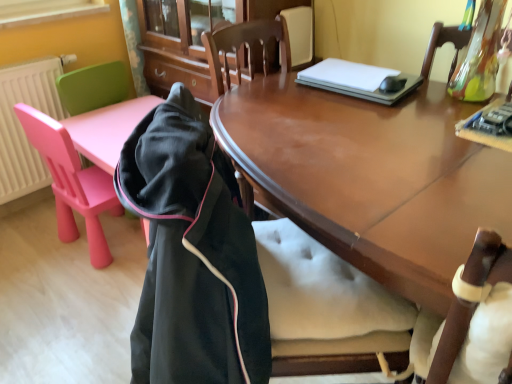
This screenshot has height=384, width=512. Describe the element at coordinates (192, 255) in the screenshot. I see `black fleece jacket at left` at that location.

Describe the element at coordinates (72, 183) in the screenshot. I see `pink plastic chair at left, the 2th chair when ordered from back to front` at that location.

What do you see at coordinates (101, 111) in the screenshot? The width and height of the screenshot is (512, 384). I see `pink plastic chair at left, which ranks as the first chair in back-to-front order` at bounding box center [101, 111].

I want to click on shiny brown wood desk at center, so click(371, 177).

Is pink plastic chair at left, which ranks as the first chair in back-to-front order, smaller than black fleece jacket at left?

Yes.

Looking at this image, in terms of width, does pink plastic chair at left, which ranks as the first chair in back-to-front order, look wider or thinner when compared to black fleece jacket at left?

In the image, pink plastic chair at left, which ranks as the first chair in back-to-front order, appears to be wider than black fleece jacket at left.

There is a black fleece jacket at left. Where is `the 2nd chair above it (from the image's perspective)`? This screenshot has height=384, width=512. the 2nd chair above it (from the image's perspective) is located at coordinates (101, 111).

From a real-world perspective, which object stands above the other?

black fleece jacket at left, from a real-world perspective.

Considering the relative sizes of pink plastic chair at left, the 2th chair when ordered from back to front, and matte wood cabinet at center in the image provided, is pink plastic chair at left, the 2th chair when ordered from back to front, shorter than matte wood cabinet at center?

Indeed, pink plastic chair at left, the 2th chair when ordered from back to front, has a lesser height compared to matte wood cabinet at center.

Which is less distant, [24,116] or [172,54]?

Point [24,116].

From the image's perspective, which object appears higher, pink plastic chair at left, the 2th chair when ordered from back to front, or matte wood cabinet at center?

matte wood cabinet at center is shown above in the image.

How much distance is there between pink plastic chair at left, the 2th chair when ordered from back to front, and matte wood cabinet at center?

A distance of 71.38 centimeters exists between pink plastic chair at left, the 2th chair when ordered from back to front, and matte wood cabinet at center.

Is pink plastic chair at left, placed as the 1th chair when sorted from front to back, further to camera compared to shiny brown wood desk at center?

Yes, it is.

From the image's perspective, relative to shiny brown wood desk at center, is pink plastic chair at left, placed as the 1th chair when sorted from front to back, above or below?

From the image's perspective, pink plastic chair at left, placed as the 1th chair when sorted from front to back, appears above shiny brown wood desk at center.

Does pink plastic chair at left, the 2th chair when ordered from back to front, touch shiny brown wood desk at center?

There is a gap between pink plastic chair at left, the 2th chair when ordered from back to front, and shiny brown wood desk at center.

Is pink plastic chair at left, the 2th chair when ordered from back to front, spatially inside shiny brown wood desk at center, or outside of it?

pink plastic chair at left, the 2th chair when ordered from back to front, is not inside shiny brown wood desk at center, it's outside.

From a real-world perspective, relative to black fleece jacket at left, is shiny brown wood desk at center vertically above or below?

In terms of real-world spatial position, shiny brown wood desk at center is below black fleece jacket at left.

Considering the sizes of shiny brown wood desk at center and black fleece jacket at left in the image, is shiny brown wood desk at center wider or thinner than black fleece jacket at left?

Clearly, shiny brown wood desk at center has more width compared to black fleece jacket at left.

Locate an element on the screen. The height and width of the screenshot is (384, 512). desk behind the black fleece jacket at left is located at coordinates (371, 177).

Considering the sizes of objects black fleece jacket at left and white plastic radiator at left in the image provided, who is shorter, black fleece jacket at left or white plastic radiator at left?

Standing shorter between the two is white plastic radiator at left.

Locate an element on the screen. This screenshot has height=384, width=512. radiator above the black fleece jacket at left (from the image's perspective) is located at coordinates (21, 125).

From the image's perspective, would you say black fleece jacket at left is shown under white plastic radiator at left?

Indeed, from the image's perspective, black fleece jacket at left is shown beneath white plastic radiator at left.

Based on the photo, is black fleece jacket at left far from white plastic radiator at left?

Yes.

Does matte wood cabinet at center have a lesser height compared to white plastic radiator at left?

No.

Is matte wood cabinet at center next to white plastic radiator at left?

No, matte wood cabinet at center is not touching white plastic radiator at left.

At what (x,y) coordinates should I click in order to perform the action: click on cabinetry above the white plastic radiator at left (from a real-world perspective). Please return your answer as a coordinate pair (x, y). This screenshot has height=384, width=512. Looking at the image, I should click on (175, 46).

Does matte wood cabinet at center have a larger size compared to white plastic radiator at left?

Yes, matte wood cabinet at center is bigger than white plastic radiator at left.

Considering the sizes of objects black fleece jacket at left and pink plastic chair at left, the 2th chair when ordered from back to front, in the image provided, who is smaller, black fleece jacket at left or pink plastic chair at left, the 2th chair when ordered from back to front,?

A: With smaller size is pink plastic chair at left, the 2th chair when ordered from back to front.

From a real-world perspective, which is physically below, black fleece jacket at left or pink plastic chair at left, the 2th chair when ordered from back to front?

From a 3D spatial view, pink plastic chair at left, the 2th chair when ordered from back to front, is below.

Is black fleece jacket at left not near pink plastic chair at left, the 2th chair when ordered from back to front?

They are positioned close to each other.

Could you tell me if black fleece jacket at left is facing pink plastic chair at left, the 2th chair when ordered from back to front?

No, black fleece jacket at left does not turn towards pink plastic chair at left, the 2th chair when ordered from back to front.

Locate an element on the screen. The height and width of the screenshot is (384, 512). cloak above the pink plastic chair at left, the second chair positioned from the front (from a real-world perspective) is located at coordinates (192, 255).

This screenshot has width=512, height=384. What are the coordinates of `cabinetry lying behind the pink plastic chair at left, placed as the 1th chair when sorted from front to back` in the screenshot? It's located at (175, 46).

Estimate the real-world distances between objects in this image. Which object is further from shiny brown wood desk at center, pink plastic chair at left, placed as the 1th chair when sorted from front to back, or black fleece jacket at left?

pink plastic chair at left, placed as the 1th chair when sorted from front to back, lies further to shiny brown wood desk at center than the other object.

When comparing their distances from white plastic radiator at left, does matte wood cabinet at center or shiny brown wood desk at center seem closer?

Among the two, matte wood cabinet at center is located nearer to white plastic radiator at left.

Based on their spatial positions, is white plastic radiator at left or pink plastic chair at left, placed as the 1th chair when sorted from front to back, further from shiny brown wood desk at center?

The object further to shiny brown wood desk at center is white plastic radiator at left.

Consider the image. Considering their positions, is pink plastic chair at left, the second chair positioned from the front, positioned further to white plastic radiator at left than shiny brown wood desk at center?

shiny brown wood desk at center.

Looking at the image, which one is located closer to black fleece jacket at left, matte wood cabinet at center or white plastic radiator at left?

matte wood cabinet at center is closer to black fleece jacket at left.

Estimate the real-world distances between objects in this image. Which object is further from black fleece jacket at left, pink plastic chair at left, placed as the 1th chair when sorted from front to back, or shiny brown wood desk at center?

pink plastic chair at left, placed as the 1th chair when sorted from front to back.

Which object lies nearer to the anchor point white plastic radiator at left, shiny brown wood desk at center or pink plastic chair at left, the second chair positioned from the front?

pink plastic chair at left, the second chair positioned from the front.

Considering their positions, is pink plastic chair at left, the 2th chair when ordered from back to front, positioned closer to matte wood cabinet at center than shiny brown wood desk at center?

pink plastic chair at left, the 2th chair when ordered from back to front.

The image size is (512, 384). In order to click on chair positioned between shiny brown wood desk at center and pink plastic chair at left, the second chair positioned from the front, from near to far in this screenshot , I will do 72,183.

At what (x,y) coordinates should I click in order to perform the action: click on chair between shiny brown wood desk at center and matte wood cabinet at center along the z-axis. Please return your answer as a coordinate pair (x, y). This screenshot has width=512, height=384. Looking at the image, I should click on (72, 183).

Find the location of a particular element. chair located between black fleece jacket at left and white plastic radiator at left in the depth direction is located at coordinates (72, 183).

Where is `cabinetry between shiny brown wood desk at center and pink plastic chair at left, which ranks as the first chair in back-to-front order, in the front-back direction`? This screenshot has width=512, height=384. cabinetry between shiny brown wood desk at center and pink plastic chair at left, which ranks as the first chair in back-to-front order, in the front-back direction is located at coordinates (175, 46).